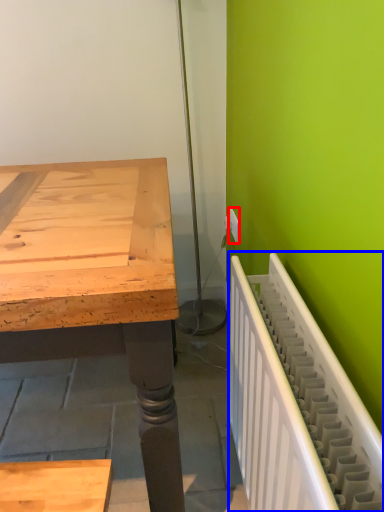
Question: Which object appears farthest to the camera in this image, electric outlet (highlighted by a red box) or radiator (highlighted by a blue box)?

Choices:
 (A) electric outlet
 (B) radiator

Answer: (A)